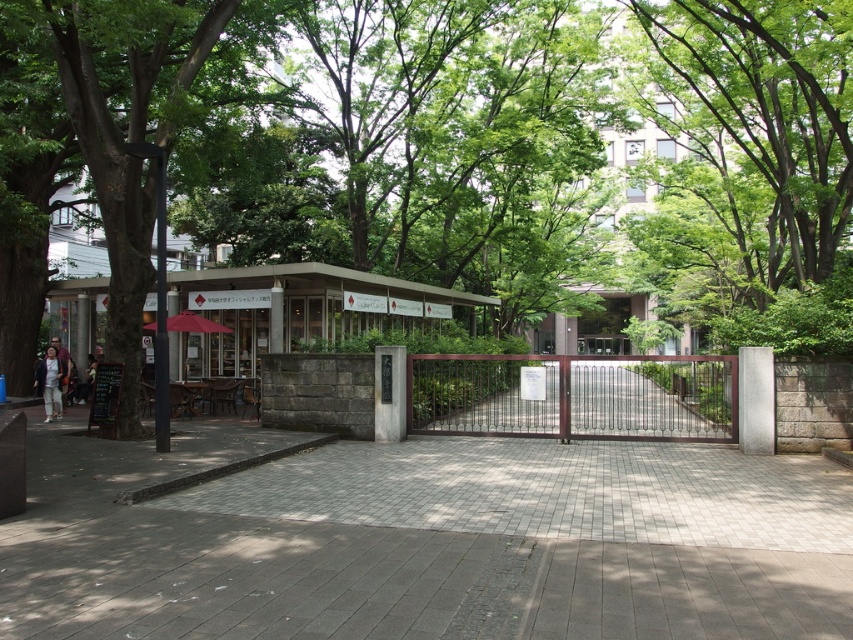
Question: Does green leafy tree at center lie behind brown metal gate at center?

Choices:
 (A) no
 (B) yes

Answer: (A)

Question: Observing the image, what is the correct spatial positioning of green leafy tree at center in reference to brown metal gate at center?

Choices:
 (A) right
 (B) left

Answer: (B)

Question: Which point is closer to the camera taking this photo?

Choices:
 (A) click(x=155, y=352)
 (B) click(x=660, y=369)
 (C) click(x=675, y=481)

Answer: (C)

Question: Which of the following is the closest to the observer?

Choices:
 (A) (157, 358)
 (B) (367, 573)
 (C) (543, 394)
 (D) (210, 12)

Answer: (B)

Question: Considering the real-world distances, which object is closest to the brown metal gate at center?

Choices:
 (A) gray brick pavement at center
 (B) light beige pants at left

Answer: (A)

Question: Does green leafy tree at center appear on the right side of light beige pants at left?

Choices:
 (A) no
 (B) yes

Answer: (B)